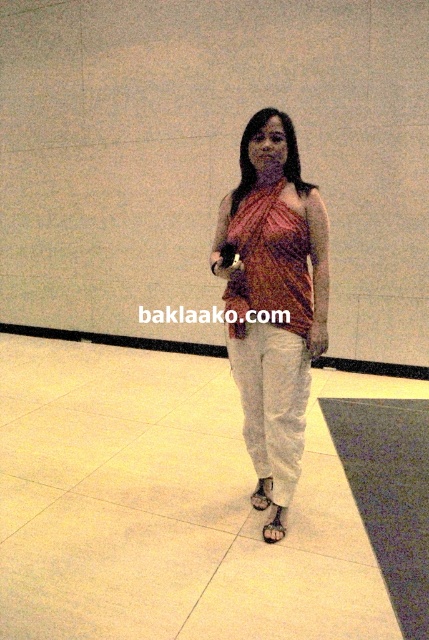
Question: Can you confirm if pink fabric dress at center is bigger than brown leather sandal at lower center?

Choices:
 (A) yes
 (B) no

Answer: (A)

Question: Can you confirm if brown leather sandal at lower center is wider than black leather sandal at lower center?

Choices:
 (A) yes
 (B) no

Answer: (A)

Question: Which point appears farthest from the camera in this image?

Choices:
 (A) [x=271, y=484]
 (B) [x=311, y=211]
 (C) [x=265, y=529]

Answer: (A)

Question: Does pink fabric dress at center appear on the left side of brown leather sandal at lower center?

Choices:
 (A) yes
 (B) no

Answer: (A)

Question: Estimate the real-world distances between objects in this image. Which object is farther from the brown leather sandal at lower center?

Choices:
 (A) black leather sandal at lower center
 (B) pink fabric dress at center

Answer: (B)

Question: Among these objects, which one is farthest from the camera?

Choices:
 (A) brown leather sandal at lower center
 (B) pink fabric dress at center

Answer: (A)